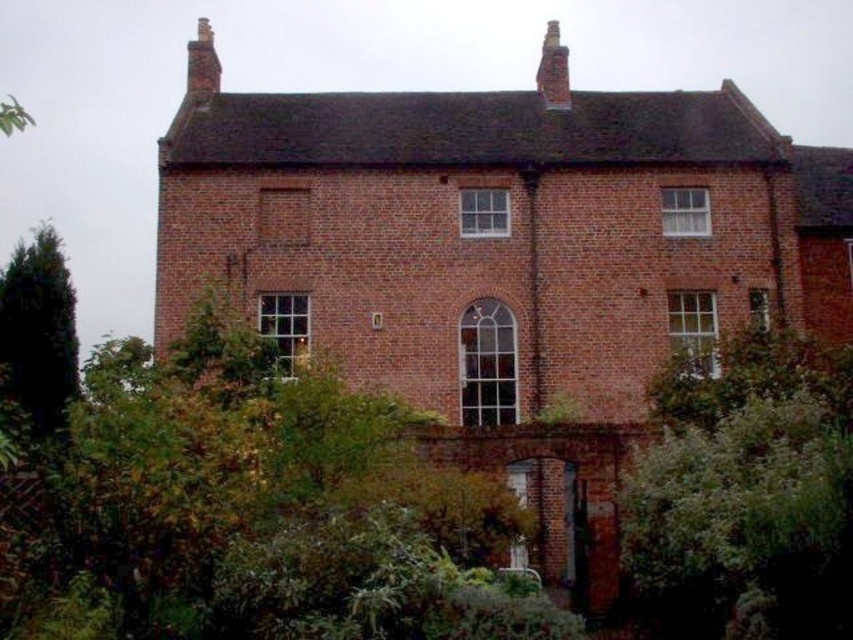
You are standing in front of the two story brick house. You see a point marked at coordinate (553,70). What does this point indicate?

The point at coordinate (553,70) marks the location of the red brick chimney at upper center.

Consider the image. You are standing in front of the house and want to plant a new tree in your garden. The existing green leafy tree at left is located at coordinates point 0.517, 0.047. If you want to plant the new tree exactly 1.5 meters to the right of the existing tree, what would be the new coordinates for the planting spot?

The new coordinates for the planting spot would be calculated by adding 1.5 meters to the x or y coordinate of the existing tree. However, without knowing the scale of the coordinate system, it is impossible to determine the exact new coordinates. Please provide the scale of the coordinate system to calculate the precise location.

You are standing in front of the house and notice both the green leafy tree at left and the red brick chimney at upper center. Which object is positioned higher relative to the other?

The red brick chimney at upper center is positioned higher than the green leafy tree at left.